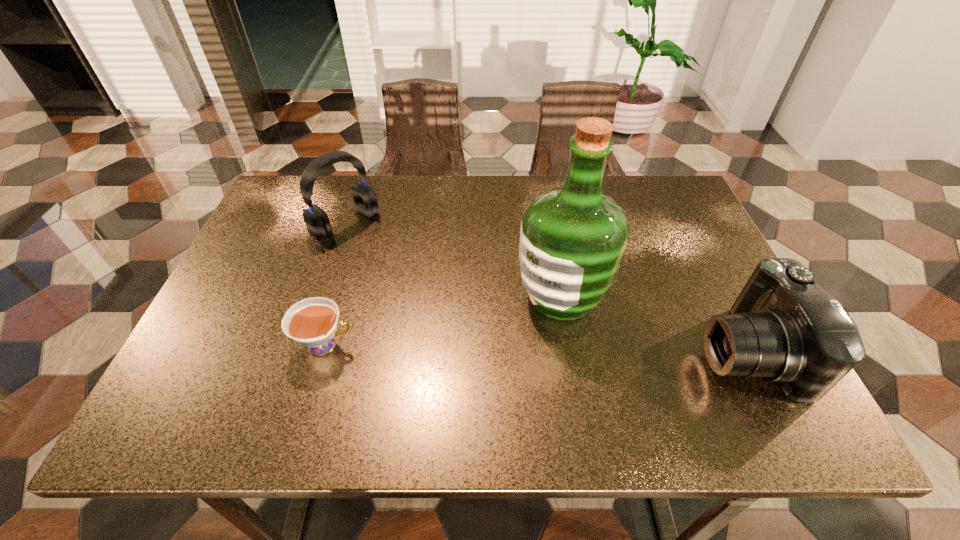
This screenshot has width=960, height=540. Identify the location of vacant space on the desktop that is between the shortest object and the camera and is positioned on the headband of the second tallest object. (503, 347).

Find the location of a particular element. vacant space on the desktop that is between the shortest object and the rightmost object and is positioned on the front-facing side of the third object from left to right is located at coordinates (473, 347).